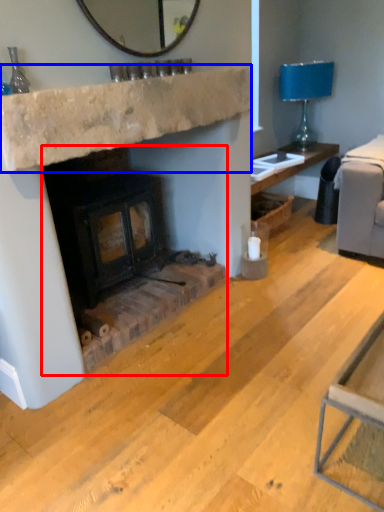
Question: Which object is further to the camera taking this photo, wood burning stove (highlighted by a red box) or counter top (highlighted by a blue box)?

Choices:
 (A) wood burning stove
 (B) counter top

Answer: (A)